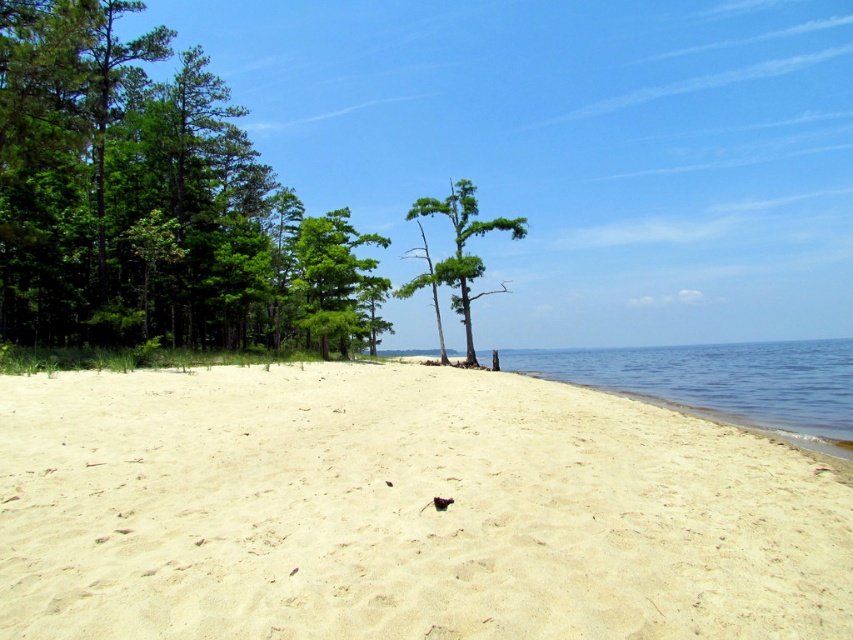
Does white sandy beach at center have a lesser width compared to clear blue water at lower right?

Yes.

How distant is white sandy beach at center from clear blue water at lower right?

29.71 meters

Does point (555, 508) come closer to viewer compared to point (705, 360)?

That is True.

Locate an element on the screen. Image resolution: width=853 pixels, height=640 pixels. white sandy beach at center is located at coordinates (401, 512).

Is white sandy beach at center to the left of green leafy trees at left from the viewer's perspective?

No, white sandy beach at center is not to the left of green leafy trees at left.

Does white sandy beach at center appear over green leafy trees at left?

Actually, white sandy beach at center is below green leafy trees at left.

What do you see at coordinates (401, 512) in the screenshot? The image size is (853, 640). I see `white sandy beach at center` at bounding box center [401, 512].

The width and height of the screenshot is (853, 640). In order to click on white sandy beach at center in this screenshot , I will do `click(401, 512)`.

Is white sandy beach at center shorter than green leafy tree at center?

Yes.

Is white sandy beach at center smaller than green leafy tree at center?

Correct, white sandy beach at center occupies less space than green leafy tree at center.

Between point (431, 444) and point (480, 273), which one is positioned behind?

Positioned behind is point (480, 273).

The height and width of the screenshot is (640, 853). I want to click on white sandy beach at center, so [401, 512].